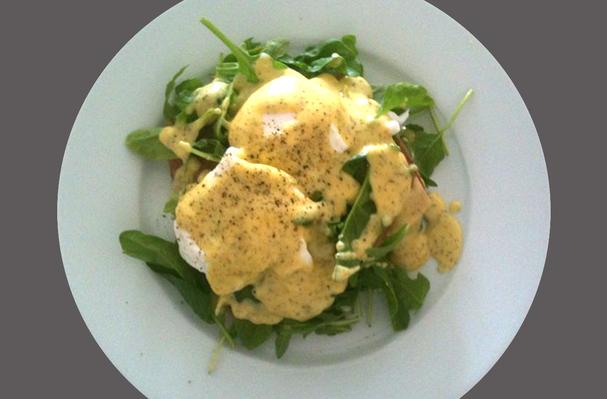
You are a GUI agent. You are given a task and a screenshot of the screen. Output one action in this format:
    pyautogui.click(x=<x>, y=<y>)
    Task: Click on the lower portion of plate
    
    Given the screenshot: What is the action you would take?
    pyautogui.click(x=302, y=395)